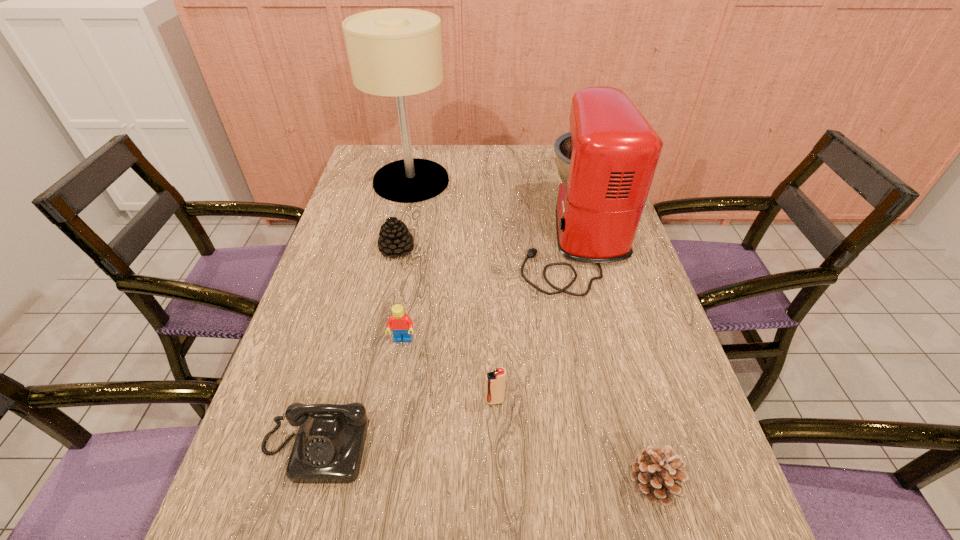
I want to click on vacant space located 0.140m on the front-facing side of the kitchen mixer, so click(468, 238).

You are a GUI agent. You are given a task and a screenshot of the screen. Output one action in this format:
    pyautogui.click(x=<x>, y=<y>)
    Task: Click on the free space located on the front-facing side of the kitchen mixer
    This screenshot has height=540, width=960.
    Given the screenshot: What is the action you would take?
    pyautogui.click(x=407, y=238)

Locate an element on the screen. The image size is (960, 540). free spot located 0.310m on the face of the fourth nearest object is located at coordinates (379, 488).

You are a GUI agent. You are given a task and a screenshot of the screen. Output one action in this format:
    pyautogui.click(x=<x>, y=<y>)
    Task: Click on the free region located at the narrow end of the farther pinecone
    Image resolution: width=960 pixels, height=540 pixels.
    Given the screenshot: What is the action you would take?
    pyautogui.click(x=386, y=305)

Locate an element on the screen. vacant space located on the left of the third nearest object is located at coordinates (334, 401).

Where is `free space located on the back of the right pinecone`? The image size is (960, 540). free space located on the back of the right pinecone is located at coordinates tap(616, 346).

This screenshot has width=960, height=540. I want to click on object located at the far edge, so click(x=397, y=52).

At what (x,y) coordinates should I click in order to perform the action: click on table lamp situated at the left edge. Please return your answer as a coordinate pair (x, y). The height and width of the screenshot is (540, 960). Looking at the image, I should click on (397, 52).

The width and height of the screenshot is (960, 540). Identify the location of pinecone located at the left edge. (395, 240).

The width and height of the screenshot is (960, 540). Identify the location of telephone present at the left edge. (328, 449).